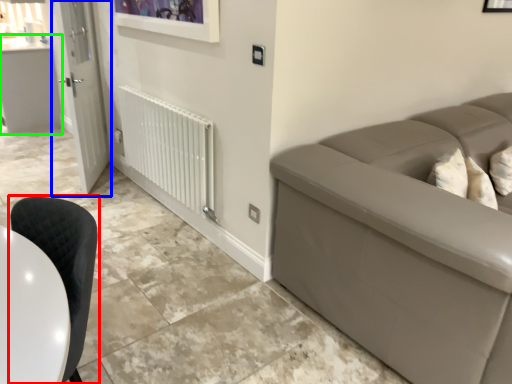
Question: Which object is the farthest from chair (highlighted by a red box)? Choose among these: door (highlighted by a blue box) or counter top (highlighted by a green box).

Choices:
 (A) door
 (B) counter top

Answer: (B)